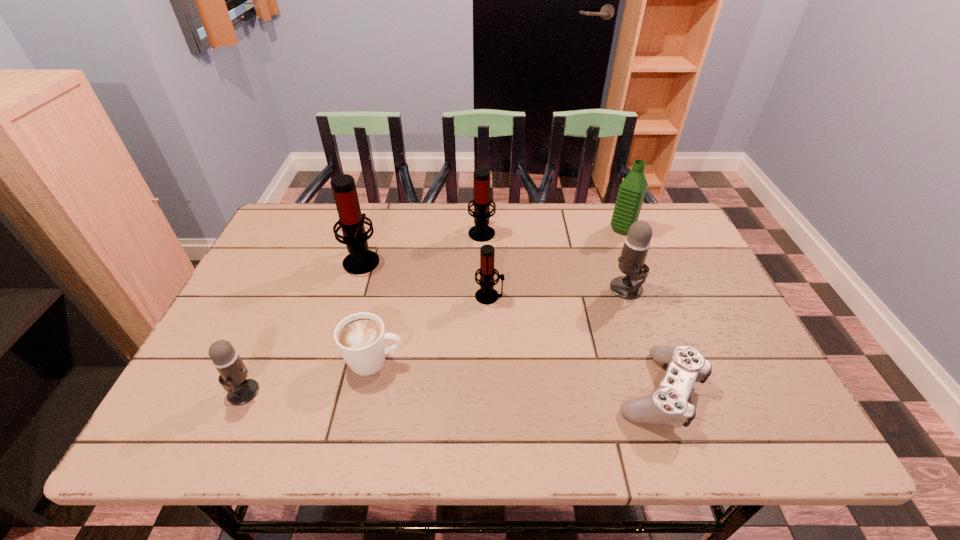
Image resolution: width=960 pixels, height=540 pixels. Identify the location of vacant area that lies between the shortest object and the leftmost object. pos(451,391).

This screenshot has height=540, width=960. What are the coordinates of `empty space between the smallest red microphone and the biggest red microphone` in the screenshot? It's located at (425, 278).

The image size is (960, 540). Find the location of `vacant space that's between the control and the cappuccino`. vacant space that's between the control and the cappuccino is located at coordinates (516, 376).

Point out which object is positioned as the nearest to the green water bottle. Please provide its 2D coordinates. Your answer should be formatted as a tuple, i.e. [(x, y)], where the tuple contains the x and y coordinates of a point satisfying the conditions above.

[(637, 242)]

Choose which object is the seventh nearest neighbor to the right gray microphone. Please provide its 2D coordinates. Your answer should be formatted as a tuple, i.e. [(x, y)], where the tuple contains the x and y coordinates of a point satisfying the conditions above.

[(233, 373)]

Where is `microphone that is the third nearest to the smallest red microphone`? microphone that is the third nearest to the smallest red microphone is located at coordinates (637, 242).

At what (x,y) coordinates should I click in order to perform the action: click on microphone that stands as the third closest to the right gray microphone. Please return your answer as a coordinate pair (x, y). This screenshot has width=960, height=540. Looking at the image, I should click on (360, 260).

Locate an element on the screen. Image resolution: width=960 pixels, height=540 pixels. red microphone that is the second closest to the left gray microphone is located at coordinates (486, 294).

Image resolution: width=960 pixels, height=540 pixels. I want to click on red microphone that stands as the second closest to the nearest red microphone, so click(360, 260).

Find the location of a particular element. This screenshot has height=540, width=960. free point that satisfies the following two spatial constraints: 1. on the front side of the water bottle; 2. with the handle on the side of the seventh tallest object is located at coordinates (673, 361).